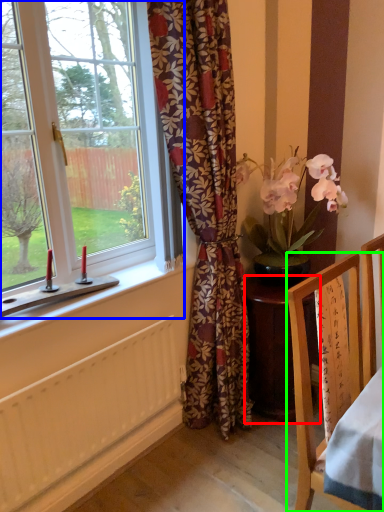
Question: Based on their relative distances, which object is nearer to desk (highlighted by a red box)? Choose from window (highlighted by a blue box) and chair (highlighted by a green box).

Choices:
 (A) window
 (B) chair

Answer: (B)